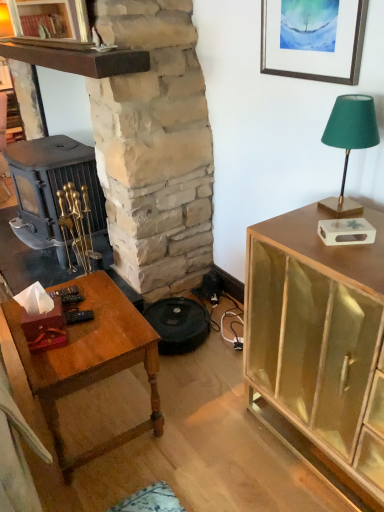
You are a GUI agent. You are given a task and a screenshot of the screen. Output one action in this format:
    pyautogui.click(x=<x>, y=<y>)
    Task: Click on the green fabric lampshade at upper right
    The image size is (384, 512).
    Given the screenshot: What is the action you would take?
    pyautogui.click(x=349, y=142)

At what (x,y) coordinates should I click in order to perform the action: click on matte gold cabinet at right. Please return your answer as a coordinate pair (x, y). This screenshot has height=512, width=384. Looking at the image, I should click on (319, 341).

This screenshot has width=384, height=512. What do you see at coordinates (155, 148) in the screenshot? I see `stone fireplace at center` at bounding box center [155, 148].

Image resolution: width=384 pixels, height=512 pixels. I want to click on green fabric lampshade at upper right, so click(x=349, y=142).

Relative to silver metallic picture frame at upper right, is green fabric lampshade at upper right in front or behind?

Clearly, green fabric lampshade at upper right is in front of silver metallic picture frame at upper right.

Considering the points (329, 144) and (348, 49), which point is behind, point (329, 144) or point (348, 49)?

Positioned behind is point (348, 49).

Are green fabric lampshade at upper right and silver metallic picture frame at upper right beside each other?

green fabric lampshade at upper right and silver metallic picture frame at upper right are not in contact.

Considering the positions of objects wooden table at lower left and green fabric lampshade at upper right in the image provided, who is more to the left, wooden table at lower left or green fabric lampshade at upper right?

From the viewer's perspective, wooden table at lower left appears more on the left side.

Considering the sizes of objects wooden table at lower left and green fabric lampshade at upper right in the image provided, who is smaller, wooden table at lower left or green fabric lampshade at upper right?

Smaller between the two is green fabric lampshade at upper right.

Considering the relative sizes of wooden table at lower left and green fabric lampshade at upper right in the image provided, is wooden table at lower left shorter than green fabric lampshade at upper right?

Incorrect, the height of wooden table at lower left does not fall short of that of green fabric lampshade at upper right.

Find the location of `fireplace in front of the wooden table at lower left`. fireplace in front of the wooden table at lower left is located at coordinates (155, 148).

Based on the photo, based on their positions, is wooden table at lower left located to the left or right of stone fireplace at center?

Clearly, wooden table at lower left is on the right of stone fireplace at center in the image.

Could you tell me if wooden table at lower left is facing stone fireplace at center?

No, wooden table at lower left is not aimed at stone fireplace at center.

Which is closer to the camera, (149, 86) or (351, 442)?

The point (351, 442) is more forward.

This screenshot has width=384, height=512. In the image, there is a stone fireplace at center. In order to click on cabinetry below it (from the image's perspective) in this screenshot , I will do `click(319, 341)`.

Is stone fireplace at center wider than matte gold cabinet at right?

Correct, the width of stone fireplace at center exceeds that of matte gold cabinet at right.

Between stone fireplace at center and matte gold cabinet at right, which one is positioned in front?

matte gold cabinet at right is more forward.

Does wooden table at lower left come in front of matte gold cabinet at right?

No.

Who is taller, wooden table at lower left or matte gold cabinet at right?

With more height is matte gold cabinet at right.

Considering the relative sizes of wooden table at lower left and matte gold cabinet at right in the image provided, is wooden table at lower left thinner than matte gold cabinet at right?

Indeed, wooden table at lower left has a lesser width compared to matte gold cabinet at right.

Does wooden table at lower left have a larger size compared to matte gold cabinet at right?

Incorrect, wooden table at lower left is not larger than matte gold cabinet at right.

From the image's perspective, who appears lower, silver metallic picture frame at upper right or wooden table at lower left?

wooden table at lower left.

Is silver metallic picture frame at upper right far from wooden table at lower left?

Indeed, silver metallic picture frame at upper right is not near wooden table at lower left.

You are a GUI agent. You are given a task and a screenshot of the screen. Output one action in this format:
    pyautogui.click(x=<x>, y=<y>)
    Task: Click on the picture frame on the right of wooden table at lower left
    
    Given the screenshot: What is the action you would take?
    pyautogui.click(x=317, y=49)

Does green fabric lampshade at upper right appear on the left side of stone fireplace at center?

No.

This screenshot has width=384, height=512. In order to click on lamp below the stone fireplace at center (from the image's perspective) in this screenshot , I will do `click(349, 142)`.

Who is taller, green fabric lampshade at upper right or stone fireplace at center?

stone fireplace at center is taller.

In the scene shown: Which of these two, green fabric lampshade at upper right or stone fireplace at center, is smaller?

green fabric lampshade at upper right is smaller.

The width and height of the screenshot is (384, 512). In order to click on lamp below the silver metallic picture frame at upper right (from the image's perspective) in this screenshot , I will do `click(349, 142)`.

The height and width of the screenshot is (512, 384). I want to click on desk below the green fabric lampshade at upper right (from a real-world perspective), so click(88, 362).

Based on their spatial positions, is matte gold cabinet at right or wooden table at lower left closer to green fabric lampshade at upper right?

Among the two, matte gold cabinet at right is located nearer to green fabric lampshade at upper right.

From the image, which object appears to be nearer to matte gold cabinet at right, wooden table at lower left or silver metallic picture frame at upper right?

wooden table at lower left is positioned closer to the anchor matte gold cabinet at right.

Which object lies further to the anchor point silver metallic picture frame at upper right, green fabric lampshade at upper right or matte gold cabinet at right?

matte gold cabinet at right is positioned further to the anchor silver metallic picture frame at upper right.

Which object lies nearer to the anchor point matte gold cabinet at right, wooden table at lower left or green fabric lampshade at upper right?

Based on the image, green fabric lampshade at upper right appears to be nearer to matte gold cabinet at right.

Looking at the image, which one is located further to wooden table at lower left, stone fireplace at center or matte gold cabinet at right?

stone fireplace at center lies further to wooden table at lower left than the other object.

When comparing their distances from matte gold cabinet at right, does green fabric lampshade at upper right or wooden table at lower left seem closer?

Among the two, green fabric lampshade at upper right is located nearer to matte gold cabinet at right.

From the image, which object appears to be nearer to matte gold cabinet at right, stone fireplace at center or wooden table at lower left?

wooden table at lower left is closer to matte gold cabinet at right.

Estimate the real-world distances between objects in this image. Which object is further from silver metallic picture frame at upper right, wooden table at lower left or stone fireplace at center?

Among the two, wooden table at lower left is located further to silver metallic picture frame at upper right.

Locate an element on the screen. Image resolution: width=384 pixels, height=512 pixels. lamp situated between stone fireplace at center and matte gold cabinet at right from left to right is located at coordinates (349, 142).

This screenshot has height=512, width=384. I want to click on desk between stone fireplace at center and matte gold cabinet at right from left to right, so click(88, 362).

Identify the location of picture frame situated between stone fireplace at center and matte gold cabinet at right from left to right. Image resolution: width=384 pixels, height=512 pixels. [317, 49].

Image resolution: width=384 pixels, height=512 pixels. Identify the location of lamp between wooden table at lower left and matte gold cabinet at right in the horizontal direction. (349, 142).